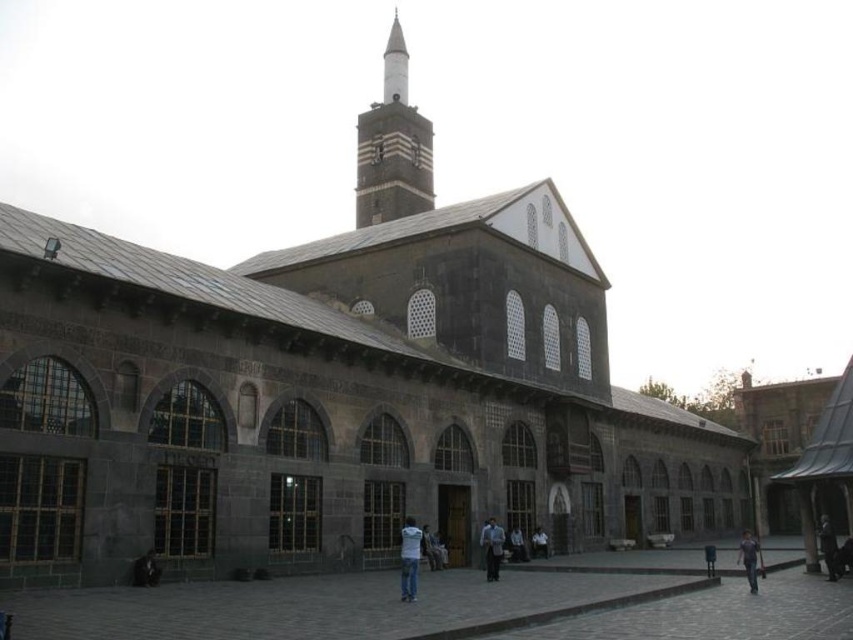
Question: Which object is closer to the camera taking this photo?

Choices:
 (A) light blue fabric shirt at center
 (B) dark brown stone minaret at center

Answer: (A)

Question: Does dark brown stone minaret at center appear on the right side of dark gray fabric coat at lower right?

Choices:
 (A) no
 (B) yes

Answer: (A)

Question: Which of these objects is positioned farthest from the light blue shirt at center?

Choices:
 (A) light blue denim jacket at center
 (B) white cotton shirt at center
 (C) dark gray fabric coat at lower right

Answer: (C)

Question: Among these objects, which one is nearest to the camera?

Choices:
 (A) denim jeans at lower right
 (B) light blue fabric shirt at center
 (C) gray stone courtyard at center
 (D) dark gray fabric coat at lower right

Answer: (C)

Question: Can you confirm if dark gray fabric coat at lower right is smaller than light blue denim jacket at center?

Choices:
 (A) yes
 (B) no

Answer: (B)

Question: Does dark gray fabric coat at lower right appear under denim jeans at lower right?

Choices:
 (A) yes
 (B) no

Answer: (B)